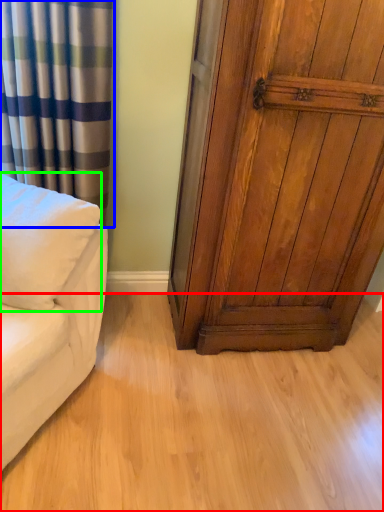
Question: Estimate the real-world distances between objects in this image. Which object is closer to plain (highlighted by a red box), curtain (highlighted by a blue box) or pillow (highlighted by a green box)?

Choices:
 (A) curtain
 (B) pillow

Answer: (B)